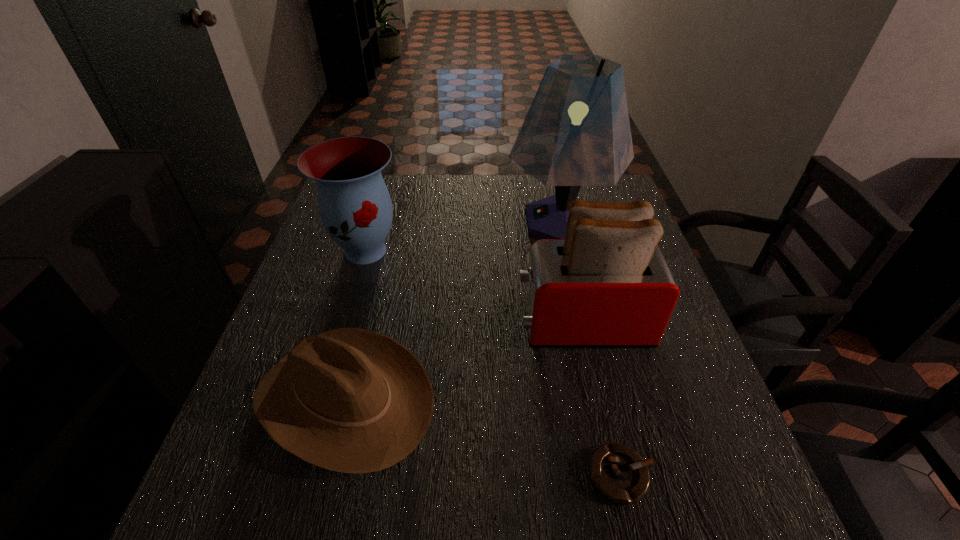
The height and width of the screenshot is (540, 960). I want to click on vacant space at the near right corner, so click(x=702, y=519).

The image size is (960, 540). Find the location of `free point between the shortest object and the vase`. free point between the shortest object and the vase is located at coordinates (493, 363).

You are a GUI agent. You are given a task and a screenshot of the screen. Output one action in this format:
    pyautogui.click(x=<x>, y=<y>)
    Task: Click on the vacant region between the second shortest object and the vase
    This screenshot has width=960, height=540.
    Given the screenshot: What is the action you would take?
    pyautogui.click(x=355, y=325)

Find the location of a particular element. The height and width of the screenshot is (540, 960). empty location between the tallest object and the vase is located at coordinates (464, 236).

Where is `free space that is in between the toaster and the vase`? The height and width of the screenshot is (540, 960). free space that is in between the toaster and the vase is located at coordinates (474, 287).

Find the location of `free space between the vase and the lampshade`. free space between the vase and the lampshade is located at coordinates (464, 236).

Where is `free point between the tallest object and the cowboy hat`? The height and width of the screenshot is (540, 960). free point between the tallest object and the cowboy hat is located at coordinates (453, 310).

What are the coordinates of `unoccupied position between the toaster and the ashtray` in the screenshot? It's located at (601, 399).

Where is `empty space between the vase and the tallest object`? empty space between the vase and the tallest object is located at coordinates (464, 236).

In order to click on free area in between the vase and the toaster in this screenshot , I will do `click(474, 287)`.